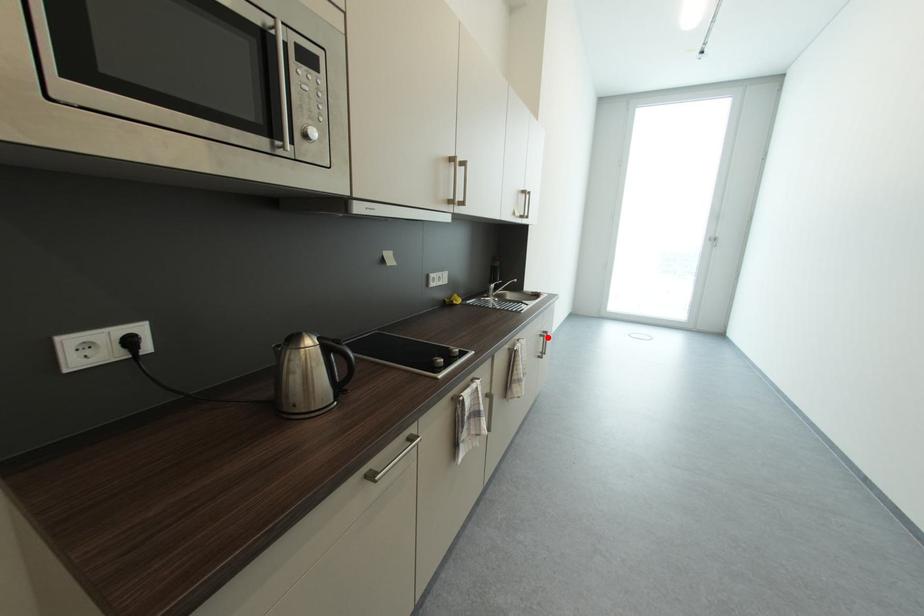
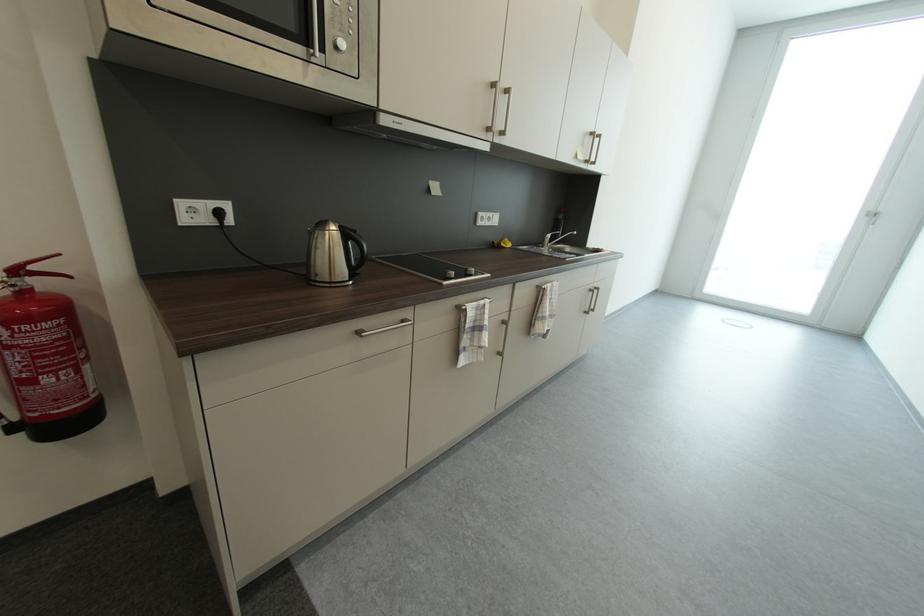
In the second image, find the point that corresponds to the highlighted location in the first image.

(598, 292)